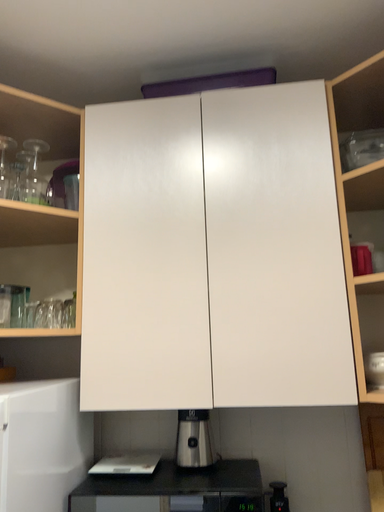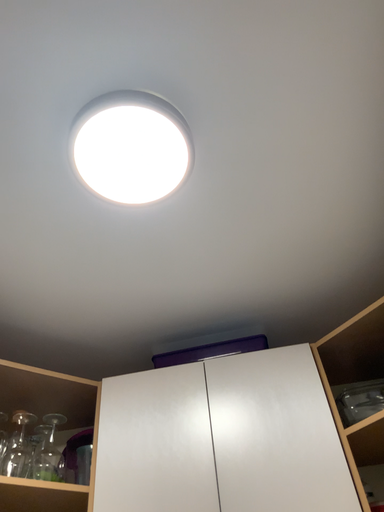
Question: How did the camera likely rotate when shooting the video?

Choices:
 (A) rotated upward
 (B) rotated downward

Answer: (A)